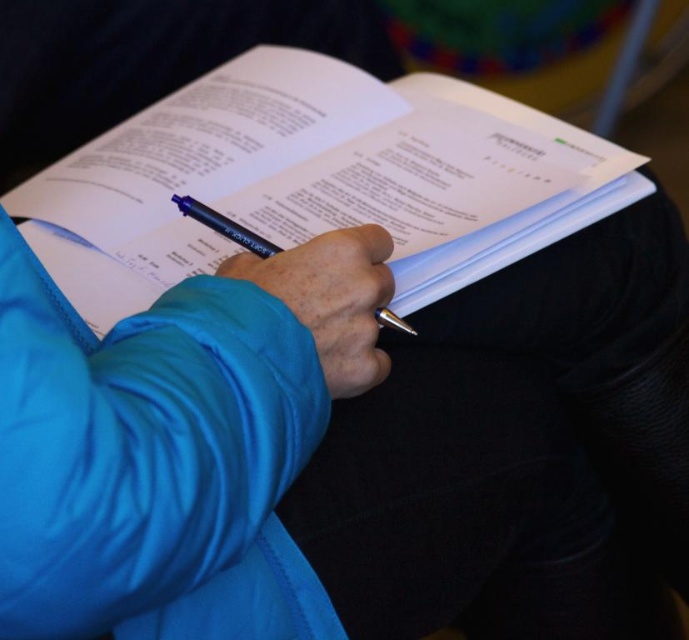
From the picture: You are an artist trying to sketch the scene. You need to decide which object should be placed higher in your drawing. Based on the scene, which one between the white paper at center and the blue fabric hand at center should be positioned higher?

The white paper at center has a greater height compared to the blue fabric hand at center, so in the drawing, the white paper at center should be placed higher than the blue fabric hand at center.